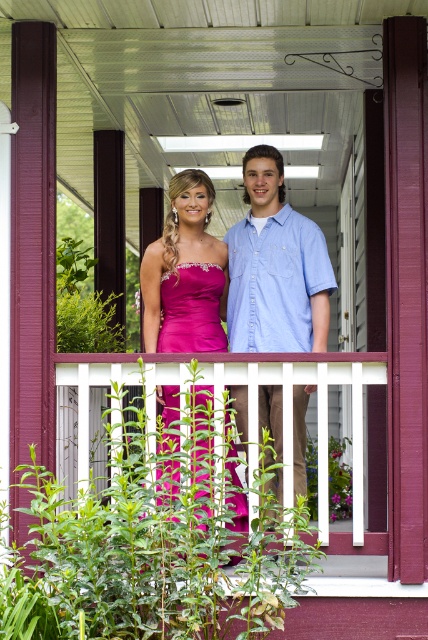
Question: Is light blue denim shirt at center closer to the viewer compared to white wooden rail at center?

Choices:
 (A) yes
 (B) no

Answer: (B)

Question: Estimate the real-world distances between objects in this image. Which object is farther from the light blue denim shirt at center?

Choices:
 (A) shiny satin dress at center
 (B) white wooden rail at center

Answer: (A)

Question: Which of the following is the closest to the observer?

Choices:
 (A) white wooden rail at center
 (B) shiny satin dress at center
 (C) light blue denim shirt at center

Answer: (B)

Question: Is light blue denim shirt at center positioned behind white wooden rail at center?

Choices:
 (A) yes
 (B) no

Answer: (A)

Question: Which point is farther to the camera?

Choices:
 (A) (287, 262)
 (B) (163, 352)
 (C) (109, 355)

Answer: (A)

Question: Is light blue denim shirt at center wider than shiny satin dress at center?

Choices:
 (A) no
 (B) yes

Answer: (B)